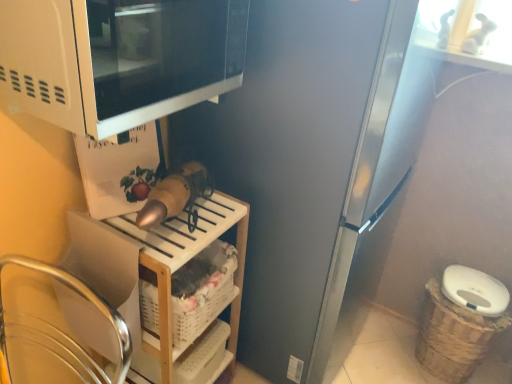
Question: Does satin silver refrigerator at center have a greater width compared to white matte microwave at upper left?

Choices:
 (A) no
 (B) yes

Answer: (B)

Question: Is satin silver refrigerator at center far away from white matte microwave at upper left?

Choices:
 (A) no
 (B) yes

Answer: (A)

Question: Is satin silver refrigerator at center directly adjacent to white matte microwave at upper left?

Choices:
 (A) yes
 (B) no

Answer: (B)

Question: Does satin silver refrigerator at center turn towards white matte microwave at upper left?

Choices:
 (A) no
 (B) yes

Answer: (A)

Question: From a real-world perspective, is satin silver refrigerator at center over white matte microwave at upper left?

Choices:
 (A) yes
 (B) no

Answer: (B)

Question: Based on their positions, is woven brown basket at lower right, placed as the 1th basket when sorted from right to left, located to the left or right of white woven basket at lower center, placed as the second basket when sorted from back to front?

Choices:
 (A) left
 (B) right

Answer: (B)

Question: Considering the positions of woven brown basket at lower right, which is the second basket from front to back, and white woven basket at lower center, placed as the second basket when sorted from back to front, in the image, is woven brown basket at lower right, which is the second basket from front to back, bigger or smaller than white woven basket at lower center, placed as the second basket when sorted from back to front,?

Choices:
 (A) big
 (B) small

Answer: (A)

Question: From the image's perspective, is woven brown basket at lower right, the second basket from the left, positioned above or below white woven basket at lower center, the first basket in the front-to-back sequence?

Choices:
 (A) below
 (B) above

Answer: (A)

Question: From a real-world perspective, is woven brown basket at lower right, which is the second basket from front to back, physically located above or below white woven basket at lower center, which is counted as the 1th basket, starting from the left?

Choices:
 (A) above
 (B) below

Answer: (B)

Question: From the image's perspective, relative to woven brown basket at lower right, placed as the 1th basket when sorted from right to left, is white plastic shelf at lower center above or below?

Choices:
 (A) below
 (B) above

Answer: (B)

Question: Considering their positions, is white plastic shelf at lower center located in front of or behind woven brown basket at lower right, the second basket from the left?

Choices:
 (A) front
 (B) behind

Answer: (A)

Question: Does point (110, 301) appear closer or farther from the camera than point (436, 360)?

Choices:
 (A) farther
 (B) closer

Answer: (B)

Question: From a real-world perspective, is white plastic shelf at lower center physically located above or below woven brown basket at lower right, which is the second basket from front to back?

Choices:
 (A) below
 (B) above

Answer: (B)

Question: From the image's perspective, is satin silver refrigerator at center located above or below white woven basket at lower center, the first basket in the front-to-back sequence?

Choices:
 (A) below
 (B) above

Answer: (B)

Question: Does point (316, 195) appear closer or farther from the camera than point (176, 317)?

Choices:
 (A) farther
 (B) closer

Answer: (A)